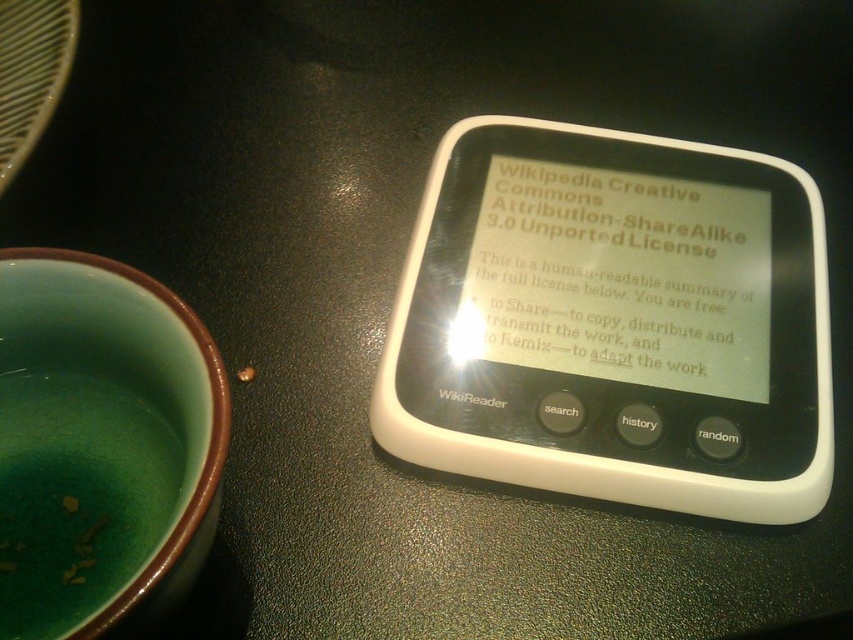
You are organizing your desk and need to place both the white paper at center and the white matte wikireader at center. Which object should you move first if you want to place the smaller one closer to the edge of the desk?

You should move the white matte wikireader at center first because it is smaller than the white paper at center, allowing you to position it closer to the edge of the desk.

You are organizing your desk and notice the black plastic wikireader at center and the white paper at center. Which object should you move first if you want to place the smaller item into a drawer?

The white paper at center is smaller than the black plastic wikireader at center, so you should move the white paper at center first.

You are organizing a desk and need to place the black plastic wikireader at center and the white paper at center. The desk has limited space between them. Can you fit a 0.5 inch thick notebook between them?

The black plastic wikireader at center is 0.68 inches from white paper at center. Since the notebook is 0.5 inches thick, it can fit between them as there is enough space.